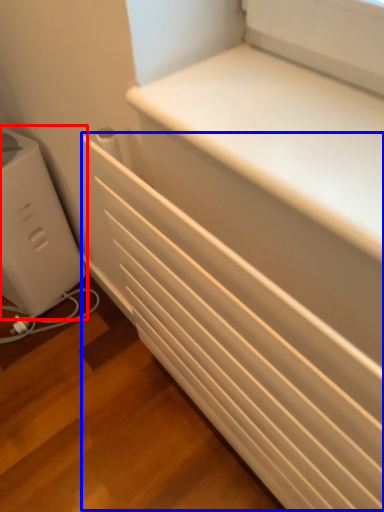
Question: Which object appears farthest to the camera in this image, home appliance (highlighted by a red box) or radiator (highlighted by a blue box)?

Choices:
 (A) home appliance
 (B) radiator

Answer: (A)